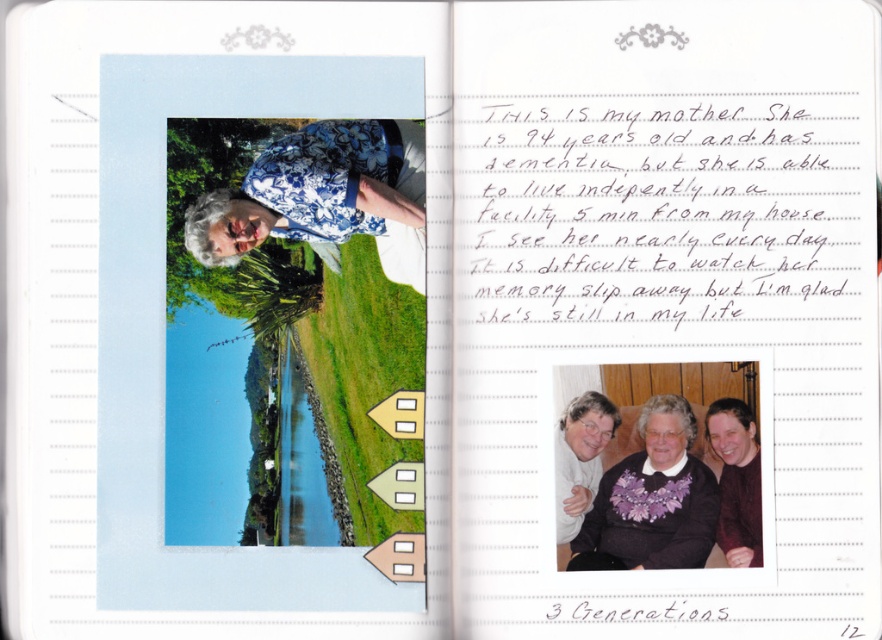
Question: Does blue floral shirt at center come behind maroon sweater at center?

Choices:
 (A) no
 (B) yes

Answer: (A)

Question: Which point appears farthest from the camera in this image?

Choices:
 (A) (735, 400)
 (B) (679, 406)

Answer: (A)

Question: Which of the following is the farthest from the observer?

Choices:
 (A) purple fabric at center
 (B) blue floral shirt at center
 (C) maroon sweater at center

Answer: (C)

Question: Observing the image, what is the correct spatial positioning of purple fabric at center in reference to maroon sweater at center?

Choices:
 (A) above
 (B) below

Answer: (B)

Question: Which of the following is the farthest from the observer?

Choices:
 (A) blue floral shirt at center
 (B) purple fabric at center

Answer: (A)

Question: Does purple fabric at center have a greater width compared to maroon sweater at center?

Choices:
 (A) no
 (B) yes

Answer: (B)